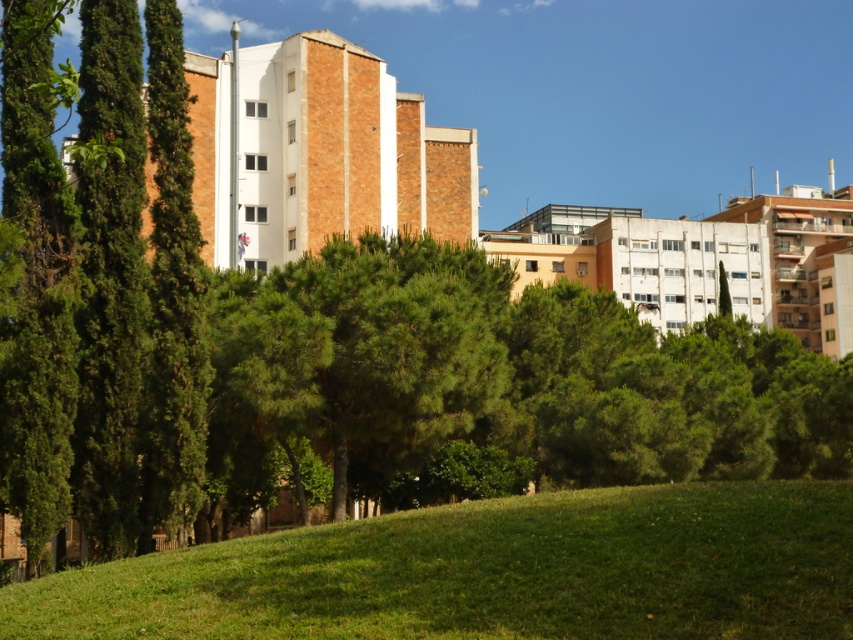
Question: Does green grassy hill at lower left appear over green needle-like tree at center?

Choices:
 (A) yes
 (B) no

Answer: (B)

Question: Can you confirm if green grassy hill at lower left is bigger than green needle-like tree at center?

Choices:
 (A) yes
 (B) no

Answer: (B)

Question: Which point is closer to the camera taking this photo?

Choices:
 (A) (440, 356)
 (B) (585, 605)

Answer: (B)

Question: Considering the relative positions of green grassy hill at lower left and green needle-like tree at center in the image provided, where is green grassy hill at lower left located with respect to green needle-like tree at center?

Choices:
 (A) right
 (B) left

Answer: (A)

Question: Which point is closer to the camera?

Choices:
 (A) green grassy hill at lower left
 (B) green needle-like tree at center

Answer: (A)